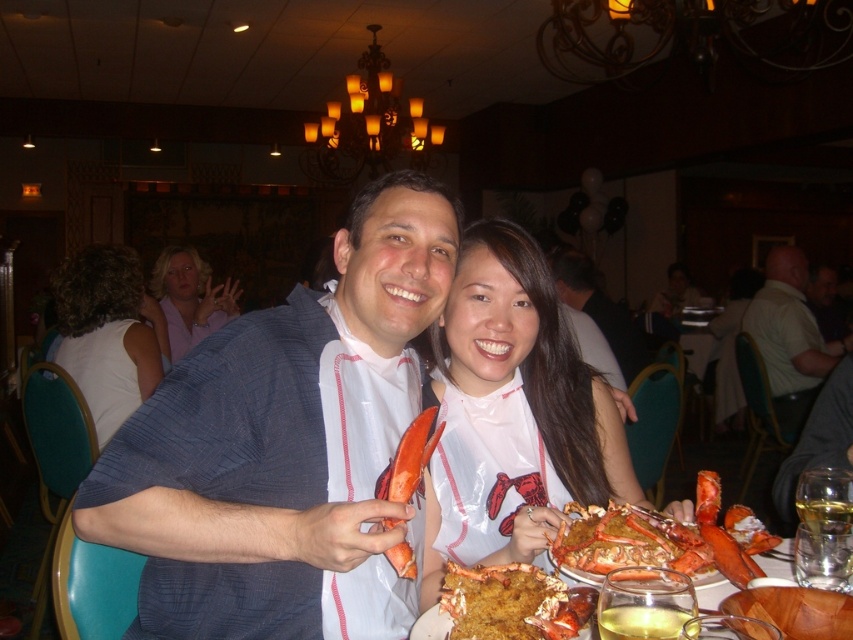
Question: Can you confirm if matte blue shirt at center is positioned to the left of white fabric shirt at left?

Choices:
 (A) yes
 (B) no

Answer: (B)

Question: Which object is closer to the camera taking this photo?

Choices:
 (A) white fabric shirt at left
 (B) matte blue shirt at center
 (C) light green shirt at center

Answer: (B)

Question: From the image, what is the correct spatial relationship of matte blue shirt at center in relation to white fabric shirt at left?

Choices:
 (A) below
 (B) above

Answer: (A)

Question: Among these objects, which one is nearest to the camera?

Choices:
 (A) matte blue shirt at center
 (B) matte white shirt at center
 (C) white fabric shirt at left

Answer: (A)

Question: Does orange smooth lobster at center have a lesser width compared to matte lobster at center?

Choices:
 (A) yes
 (B) no

Answer: (A)

Question: Which of these objects is positioned farthest from the matte white shirt at center?

Choices:
 (A) matte purple blouse at upper left
 (B) matte blue shirt at center

Answer: (B)